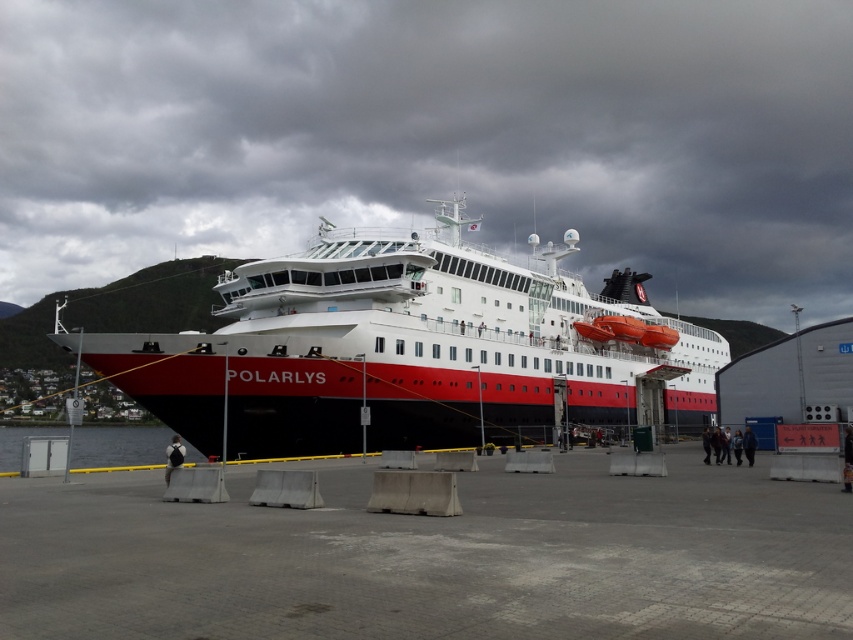
Question: Among these points, which one is farthest from the camera?

Choices:
 (A) (126, 454)
 (B) (438, 284)

Answer: (A)

Question: Does red matte ship at center appear on the right side of clear water at lower left?

Choices:
 (A) yes
 (B) no

Answer: (A)

Question: Which point is closer to the camera taking this photo?

Choices:
 (A) (254, 419)
 (B) (112, 461)

Answer: (A)

Question: Can you confirm if red matte ship at center is thinner than clear water at lower left?

Choices:
 (A) yes
 (B) no

Answer: (A)

Question: Does red matte ship at center lie behind clear water at lower left?

Choices:
 (A) yes
 (B) no

Answer: (A)